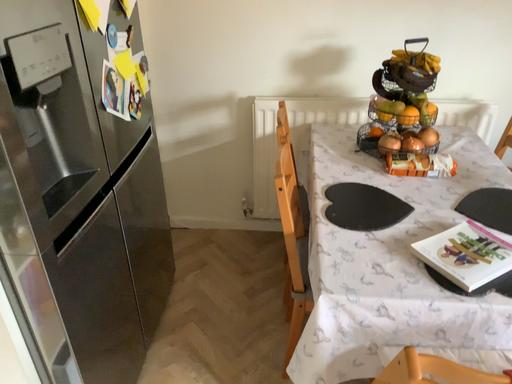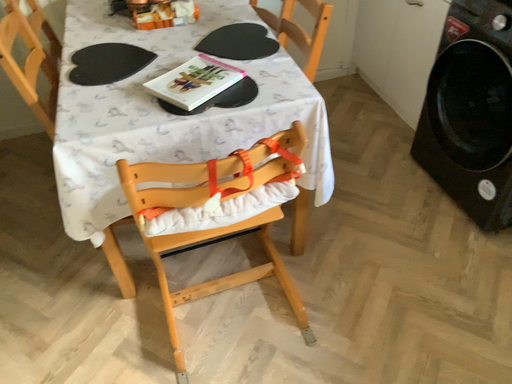
Question: How did the camera likely rotate when shooting the video?

Choices:
 (A) rotated left
 (B) rotated right

Answer: (B)